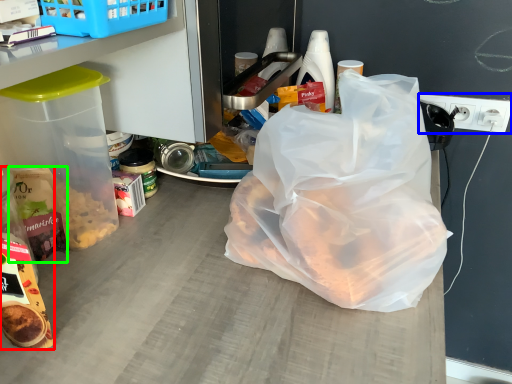
Question: Estimate the real-world distances between objects in this image. Which object is farther from snack (highlighted by a red box), electric outlet (highlighted by a blue box) or cereal (highlighted by a green box)?

Choices:
 (A) electric outlet
 (B) cereal

Answer: (A)